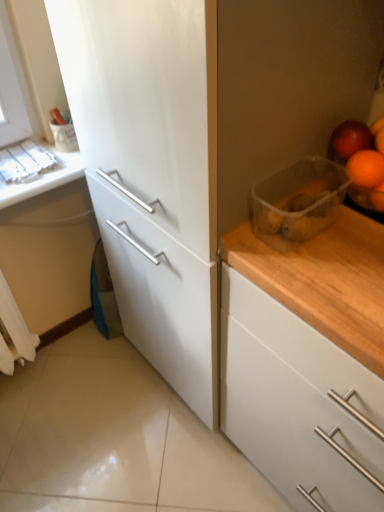
The height and width of the screenshot is (512, 384). I want to click on vacant area that lies in front of orange matte plastic at upper right, so click(x=354, y=247).